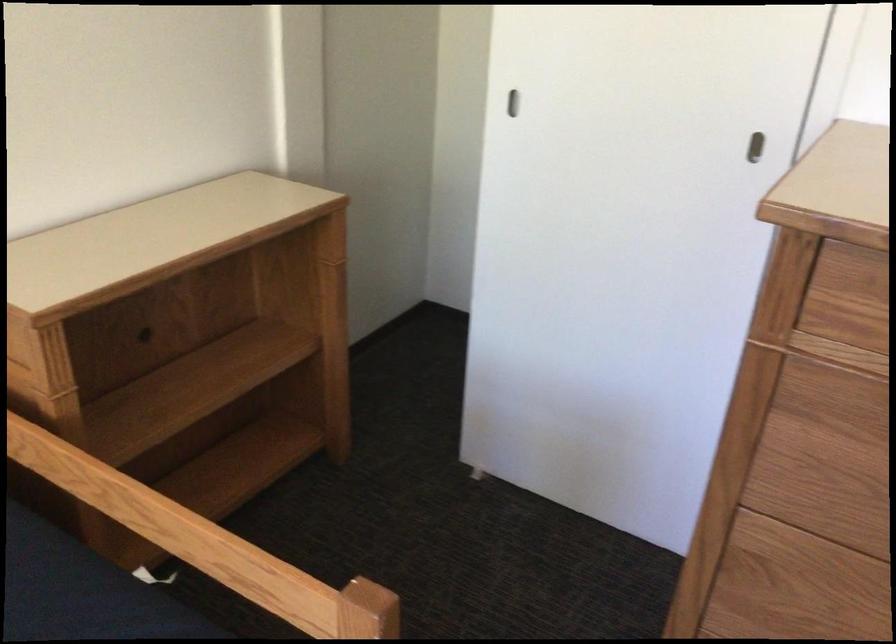
First-person continuous shooting, in which direction is the camera rotating?

The camera rotated toward left-down.